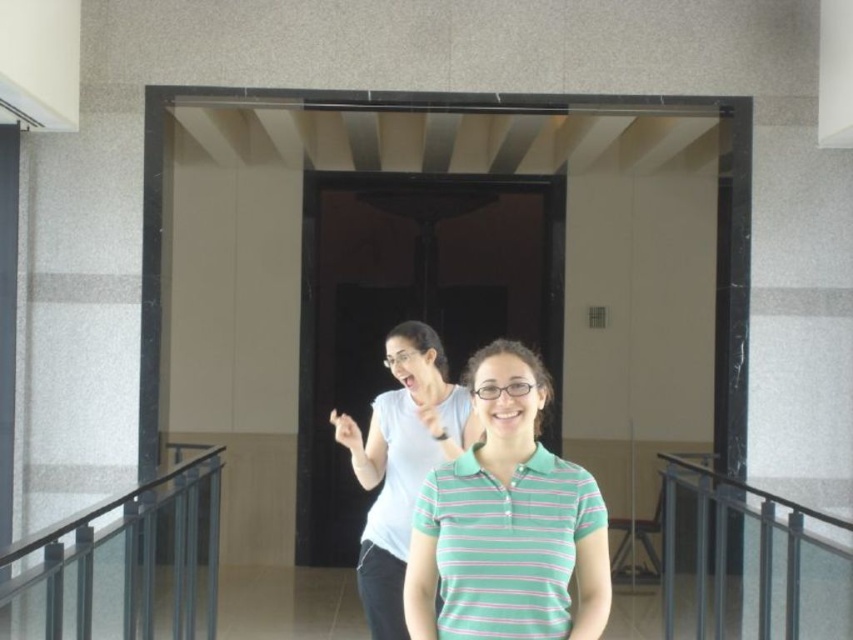
Consider the image. You are a photographer setting up a shoot in this space. You want to position a backdrop behind the metallic gray railing at lower right so that it doesn not block the green striped polo shirt at center. Where should you place the backdrop?

Place the backdrop behind the metallic gray railing at lower right. Since the green striped polo shirt at center is in front of the railing, the backdrop will not obstruct the view of the shirt.